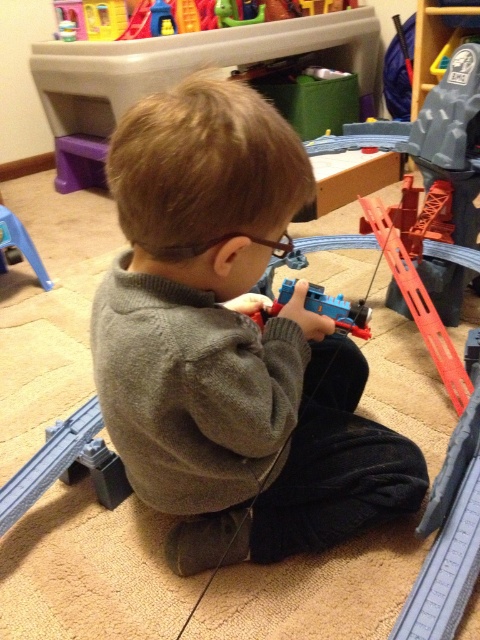
Describe the element at coordinates (230, 342) in the screenshot. I see `gray wool sweater at center` at that location.

Who is taller, gray wool sweater at center or blue plastic toy at left?

gray wool sweater at center

Is point (199, 115) positioned before point (24, 250)?

Yes, point (199, 115) is in front of point (24, 250).

This screenshot has height=640, width=480. I want to click on gray wool sweater at center, so click(230, 342).

Is plastic toy train at upper center wider than blue plastic toy at left?

Indeed, plastic toy train at upper center has a greater width compared to blue plastic toy at left.

Does plastic toy train at upper center appear under blue plastic toy at left?

Incorrect, plastic toy train at upper center is not positioned below blue plastic toy at left.

This screenshot has width=480, height=640. What are the coordinates of `plastic toy train at upper center` in the screenshot? It's located at (229, 13).

You are a GUI agent. You are given a task and a screenshot of the screen. Output one action in this format:
    pyautogui.click(x=<x>, y=<y>)
    Task: Click on the plastic toy train at upper center
    
    Given the screenshot: What is the action you would take?
    pyautogui.click(x=229, y=13)

Does blue plastic toy train at center have a smaller size compared to blue plastic toy at left?

Indeed, blue plastic toy train at center has a smaller size compared to blue plastic toy at left.

Who is higher up, blue plastic toy train at center or blue plastic toy at left?

blue plastic toy at left

Between point (357, 324) and point (36, 253), which one is positioned in front?

Point (357, 324) is more forward.

This screenshot has width=480, height=640. Find the location of `blue plastic toy train at center`. blue plastic toy train at center is located at coordinates (339, 310).